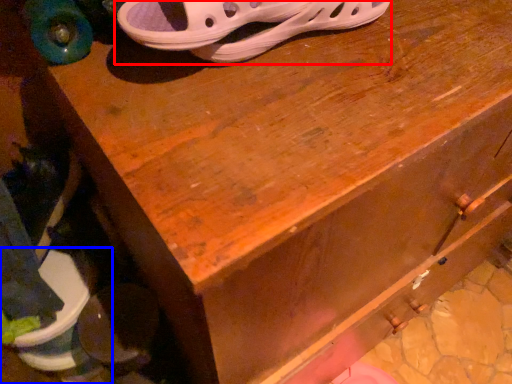
Question: Which object is further to the camera taking this photo, footwear (highlighted by a red box) or footwear (highlighted by a blue box)?

Choices:
 (A) footwear
 (B) footwear

Answer: (B)